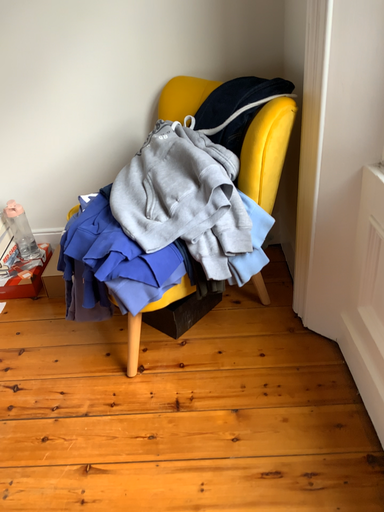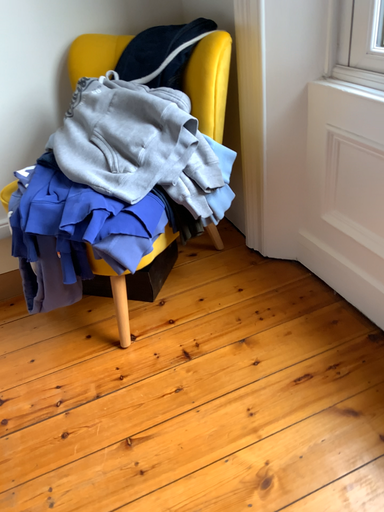
Question: Which way did the camera rotate in the video?

Choices:
 (A) rotated right
 (B) rotated left

Answer: (A)